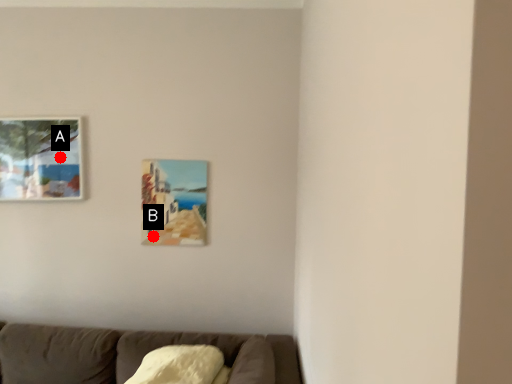
Question: Two points are circled on the image, labeled by A and B beside each circle. Which point appears farthest from the camera in this image?

Choices:
 (A) A is further
 (B) B is further

Answer: (B)